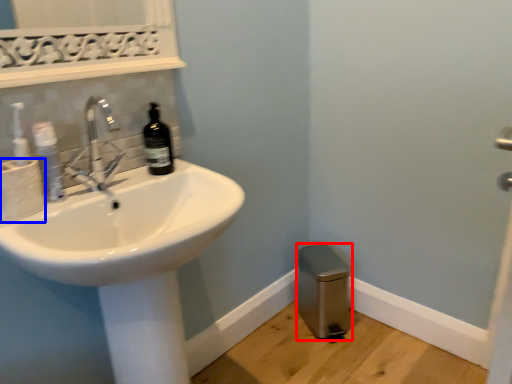
Question: Which object appears closest to the camera in this image, bidet (highlighted by a red box) or toilet paper (highlighted by a blue box)?

Choices:
 (A) bidet
 (B) toilet paper

Answer: (B)